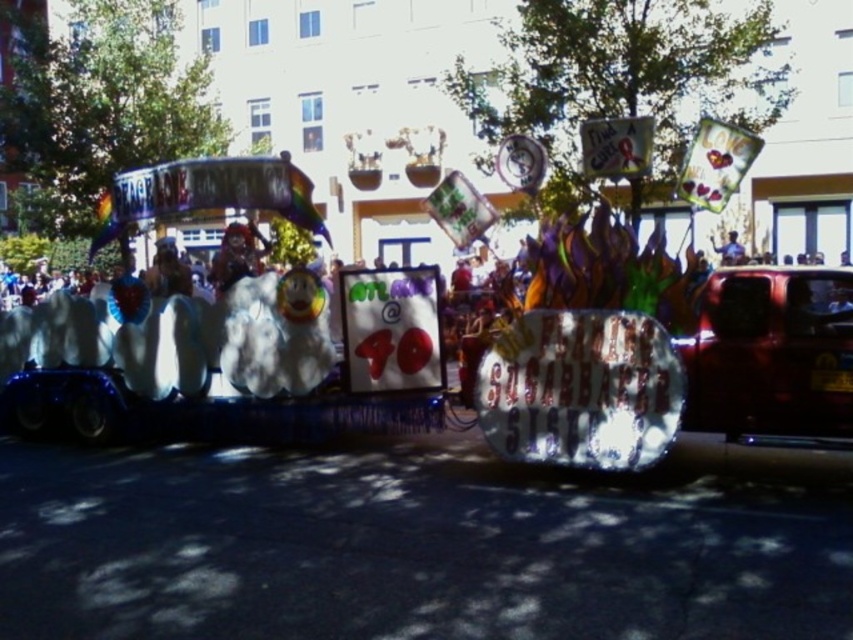
You are a photographer at the parade. You want to take a photo of both the shiny red car at right and the blue fabric shirt at center. Since you can only focus on one object at a time, which one should you focus on first to ensure it appears sharp in the photo?

You should focus on the shiny red car at right first because it is closer to the viewer than the blue fabric shirt at center. By focusing on the closer object first, you can ensure it appears sharp, and the background object may still be in acceptable focus depending on the lens and aperture used.

You are a photographer trying to capture the float from the front. You notice two points marked on the float at coordinates point (791, 300) and point (737, 243). Which point should you focus on to ensure it appears closer in your photo?

Point (791, 300) is closer to the camera than point (737, 243), so focusing on point (791, 300) will make it appear closer in the photo.